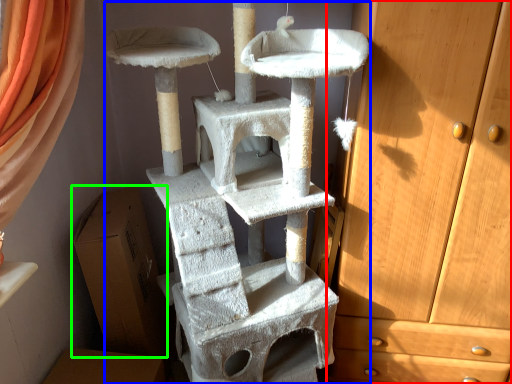
Question: Considering the real-world distances, which object is farthest from chest of drawers (highlighted by a red box)? bunk bed (highlighted by a blue box) or cardboard box (highlighted by a green box)?

Choices:
 (A) bunk bed
 (B) cardboard box

Answer: (B)